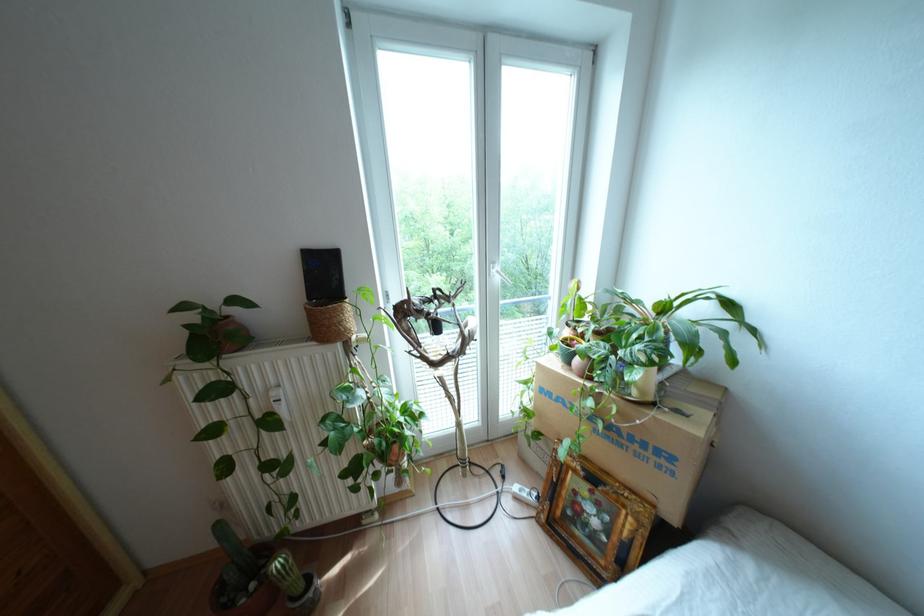
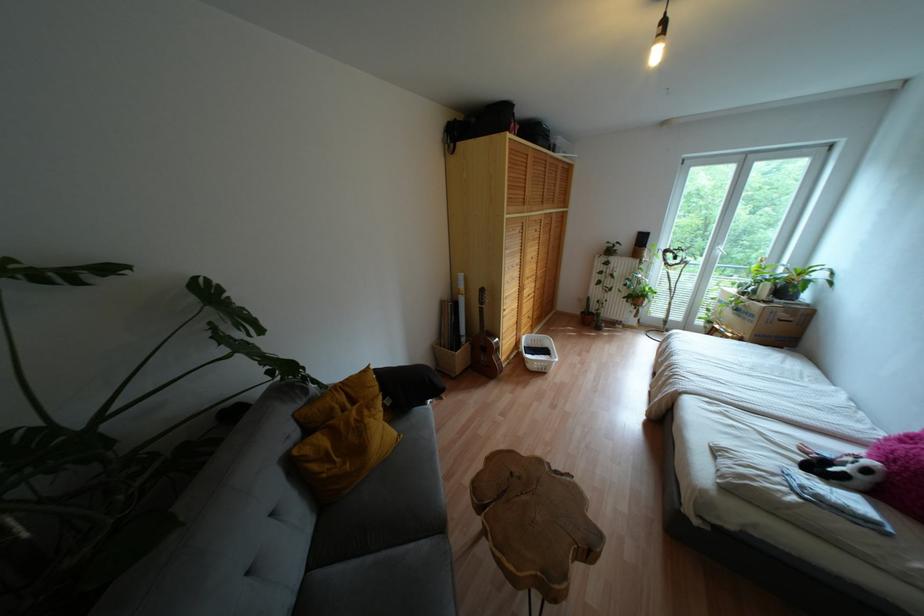
Find the pixel in the second image that matches (618,445) in the first image.

(737, 315)